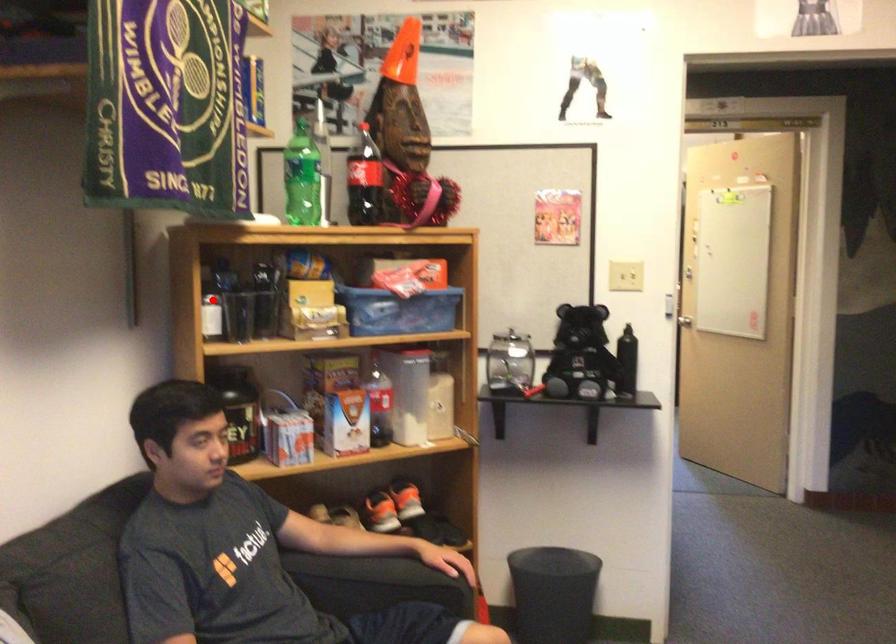
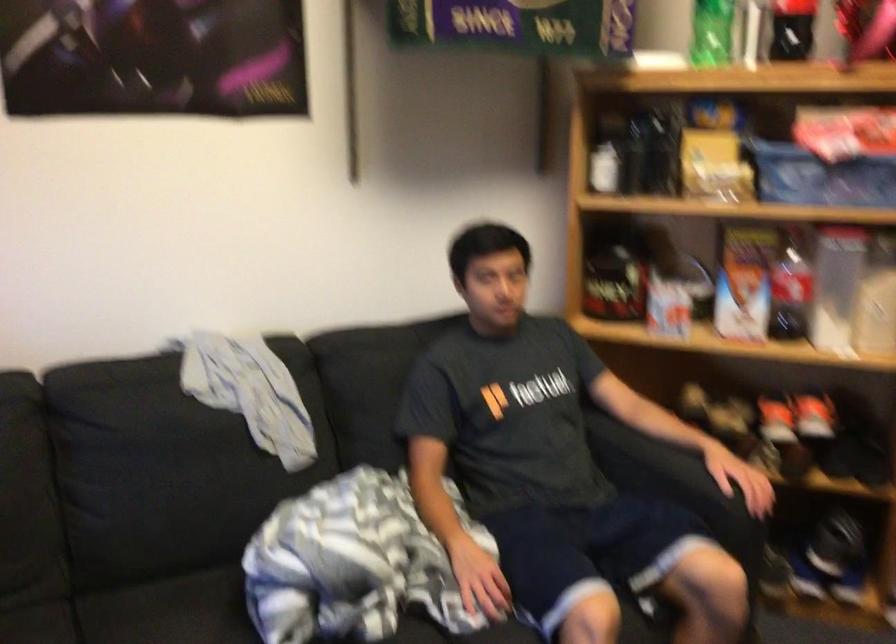
Locate, in the second image, the point that corresponds to the highlighted location in the first image.

(607, 154)